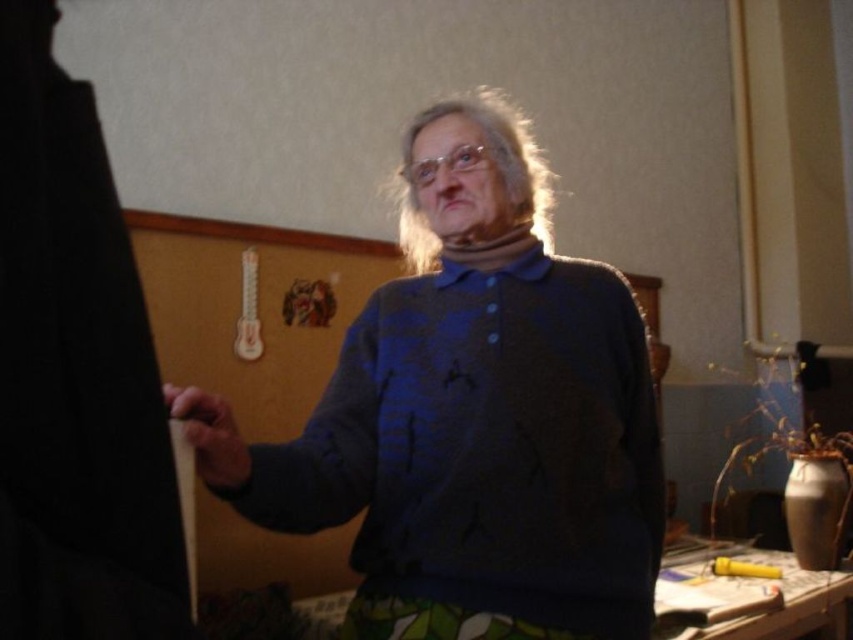
You are an artist who needs to reach the smooth wooden pencil at left to sketch the blue knitted sweater at center. Can you easily access the pencil without moving the sweater?

The blue knitted sweater at center is positioned over the smooth wooden pencil at left, so you cannot easily access the pencil without moving the sweater.

You are an interior designer assessing the space. You need to determine if the blue knitted sweater at center can be placed on a shelf that can only accommodate items wider than the smooth wooden pencil at left. Based on their widths, can the sweater fit?

The blue knitted sweater at center has a larger width than the smooth wooden pencil at left. Since the shelf requires items wider than the pencil, the sweater can fit on the shelf.